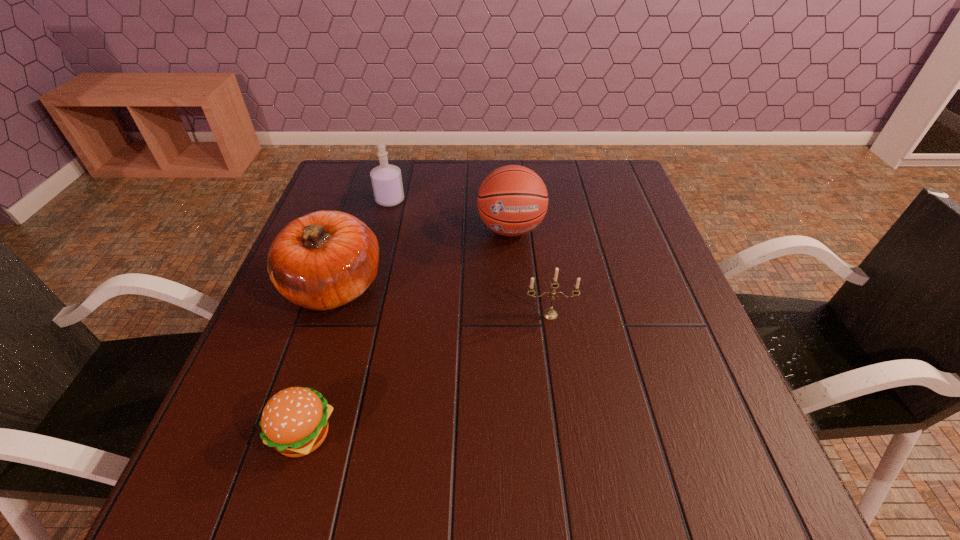
Locate an element on the screen. free spot at the left edge of the desktop is located at coordinates (260, 394).

What are the coordinates of `blank area at the right edge` in the screenshot? It's located at click(x=624, y=262).

The width and height of the screenshot is (960, 540). In order to click on vacant space at the far left corner of the desktop in this screenshot , I will do `click(344, 185)`.

You are a GUI agent. You are given a task and a screenshot of the screen. Output one action in this format:
    pyautogui.click(x=<x>, y=<y>)
    Task: Click on the vacant space at the far right corner of the desktop
    Image resolution: width=960 pixels, height=540 pixels.
    Given the screenshot: What is the action you would take?
    pyautogui.click(x=620, y=177)

The height and width of the screenshot is (540, 960). I want to click on free spot between the shortest object and the basketball, so click(x=408, y=332).

The height and width of the screenshot is (540, 960). I want to click on free space between the hamburger and the basketball, so click(408, 332).

Locate an element on the screen. free space that is in between the shortest object and the second farthest object is located at coordinates (408, 332).

The image size is (960, 540). What are the coordinates of `free point between the farthest object and the basketball` in the screenshot? It's located at (450, 214).

Where is `vacant area between the nearest object and the farthest object`? vacant area between the nearest object and the farthest object is located at coordinates (348, 317).

Identify the location of unoccupied position between the nearest object and the basketball. (408, 332).